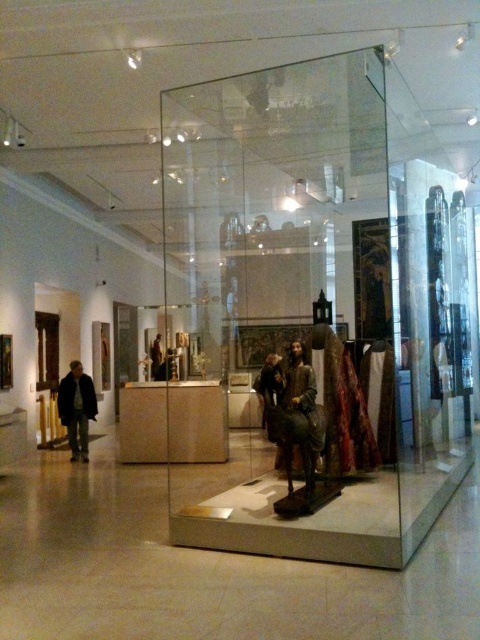
You are a visitor in the museum gallery and want to take a photo of both the point at [240,230] and the point at [276,371]. Which point should you focus on first to ensure both are in focus?

You should focus on the point at [240,230] first because it is closer to the camera than the point at [276,371]. This way, adjusting the focus from near to far will help both points come into focus.

You are a visitor in the museum and want to take a photo of the smooth brown statue at center without the transparent glass box at center blocking the view. Is there a position where you can stand to achieve this?

The transparent glass box at center is to the right of the smooth brown statue at center. Therefore, if you move to the left side of the statue, you can position yourself where the glass box won work as an obstruction, allowing you to capture a clear photo of the smooth brown statue at center.